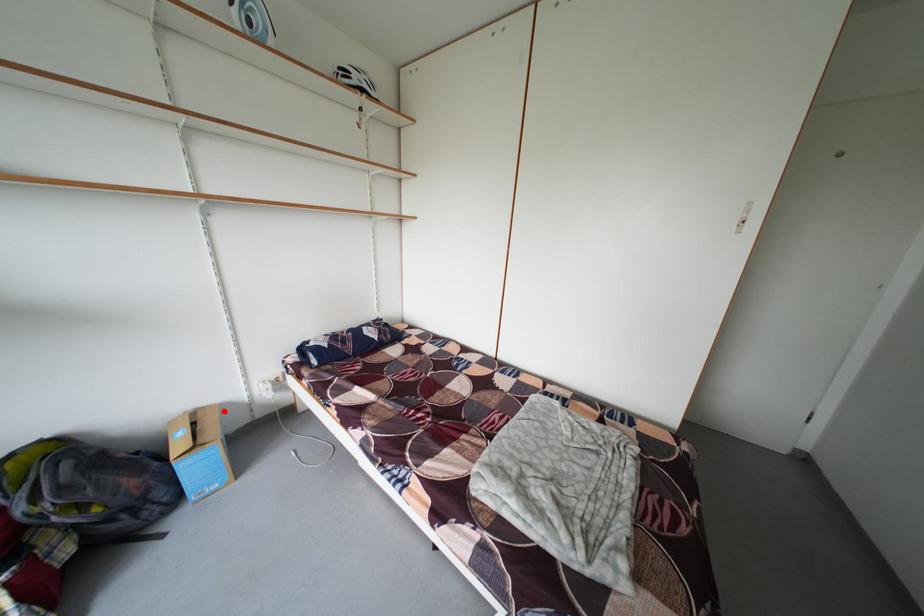
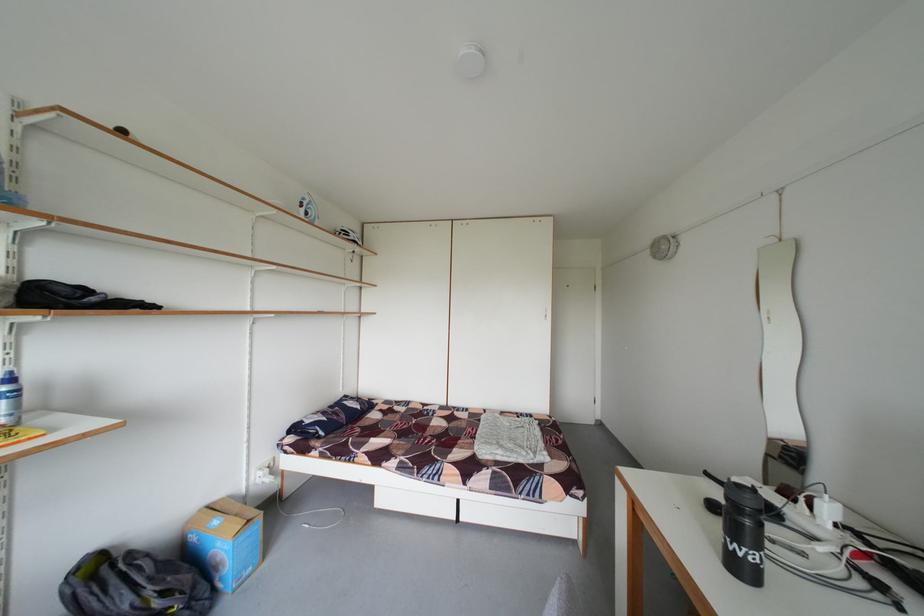
Find the pixel in the second image that matches the highlighted location in the first image.

(233, 505)